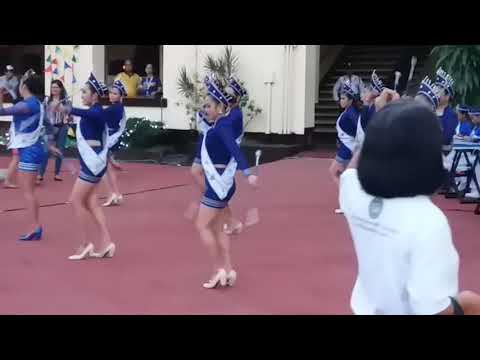
Where is `stairs`? Image resolution: width=480 pixels, height=360 pixels. stairs is located at coordinates (363, 64).